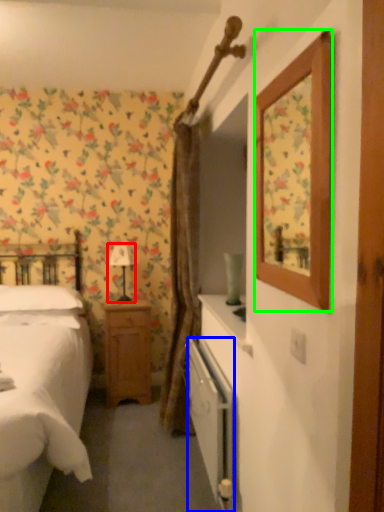
Question: Based on their relative distances, which object is nearer to table lamp (highlighted by a red box)? Choose from radiator (highlighted by a blue box) and picture frame (highlighted by a green box).

Choices:
 (A) radiator
 (B) picture frame

Answer: (B)